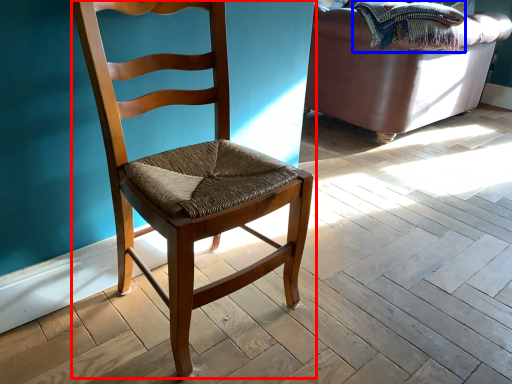
Question: Which point is closer to the camera, chair (highlighted by a red box) or blanket (highlighted by a blue box)?

Choices:
 (A) chair
 (B) blanket

Answer: (A)